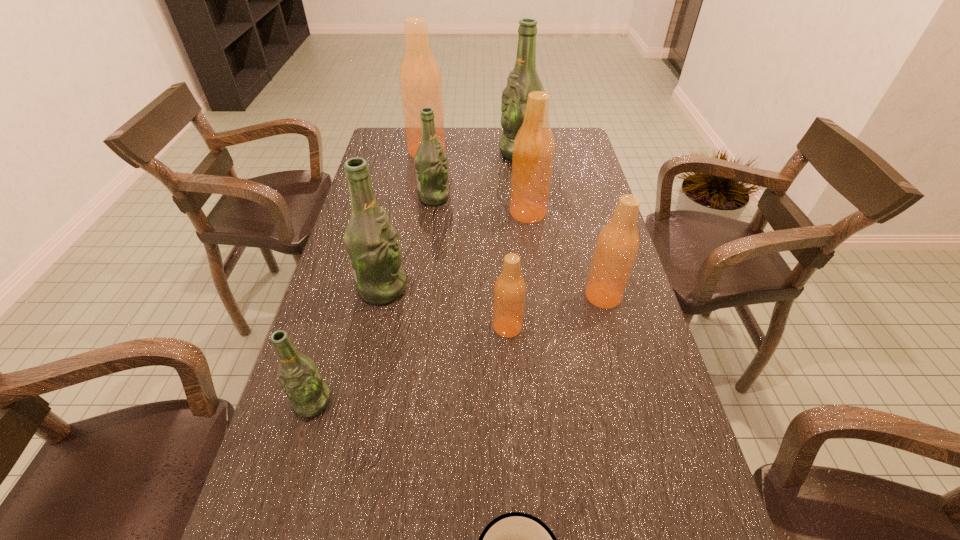
Where is `blank space located 0.120m on the front of the rightmost tan beer bottle`? blank space located 0.120m on the front of the rightmost tan beer bottle is located at coordinates (617, 349).

Where is `vacant space located on the left of the nearest tan beer bottle`? vacant space located on the left of the nearest tan beer bottle is located at coordinates (390, 327).

Image resolution: width=960 pixels, height=540 pixels. Identify the location of free space located 0.050m on the surface of the smallest green beer bottle. (300, 443).

Identify the location of object at the right edge. (617, 245).

Where is `object situated at the far left corner`? The image size is (960, 540). object situated at the far left corner is located at coordinates (420, 80).

In the image, there is a desktop. Where is `free space at the far edge`? The image size is (960, 540). free space at the far edge is located at coordinates (488, 130).

Locate an element on the screen. This screenshot has height=540, width=960. free region at the left edge is located at coordinates (393, 182).

Where is `vacant area at the right edge`? The image size is (960, 540). vacant area at the right edge is located at coordinates (593, 197).

Locate an element on the screen. free space between the third smallest green beer bottle and the second farthest tan beer bottle is located at coordinates (455, 250).

Where is `unoccupied position between the nearest tan beer bottle and the second nearest green beer bottle`? unoccupied position between the nearest tan beer bottle and the second nearest green beer bottle is located at coordinates (444, 307).